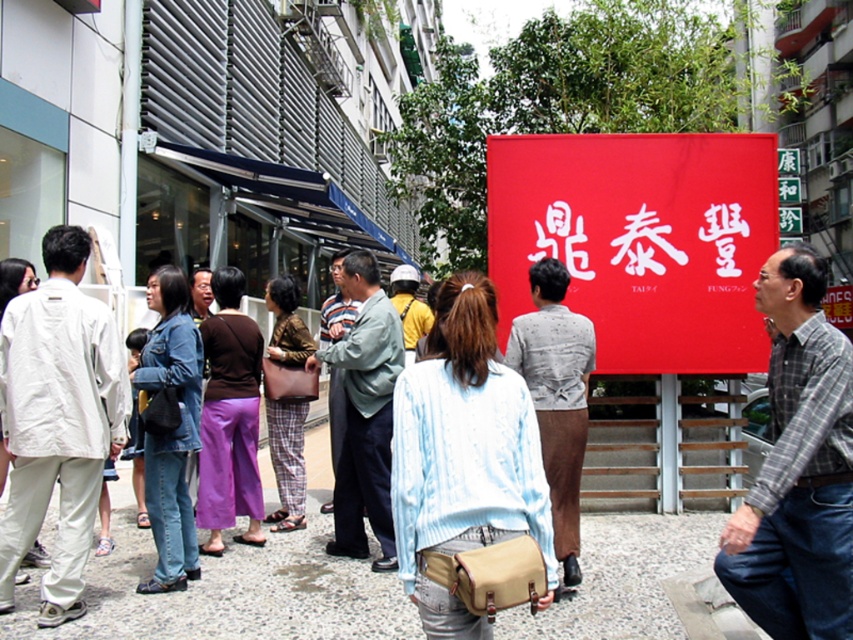
Question: Where is red fabric sign at upper center located in relation to denim jacket at center in the image?

Choices:
 (A) below
 (B) above

Answer: (B)

Question: Which of the following is the closest to the observer?

Choices:
 (A) denim jacket at center
 (B) red fabric sign at upper center

Answer: (A)

Question: Is red fabric sign at upper center to the left of denim jacket at center from the viewer's perspective?

Choices:
 (A) yes
 (B) no

Answer: (B)

Question: Is red fabric sign at upper center closer to the viewer compared to denim jacket at center?

Choices:
 (A) no
 (B) yes

Answer: (A)